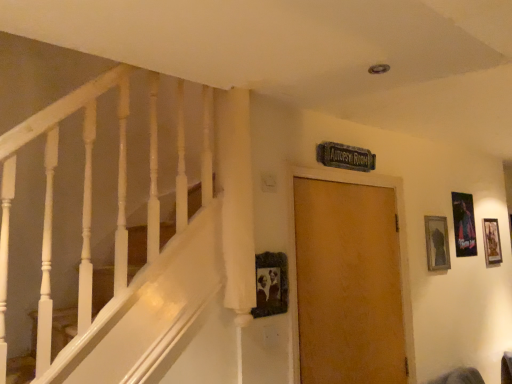
Question: Is wooden door at center wider or thinner than wooden photo frame at center, positioned as the fourth picture frame in back-to-front order?

Choices:
 (A) thin
 (B) wide

Answer: (B)

Question: From the image's perspective, is wooden door at center located above or below wooden photo frame at center, placed as the 1th picture frame when sorted from left to right?

Choices:
 (A) above
 (B) below

Answer: (B)

Question: Estimate the real-world distances between objects in this image. Which object is farther from the wooden photo frame at center, placed as the 1th picture frame when sorted from left to right?

Choices:
 (A) metallic silver poster at right, which ranks as the third picture frame in left-to-right order
 (B) metallic gold picture frame at right, which is the 1th picture frame in back-to-front order
 (C) wooden door at center
 (D) matte black picture frame at upper right, marked as the 3th picture frame in a right-to-left arrangement

Answer: (B)

Question: Based on their relative distances, which object is farther from the metallic gold picture frame at right, which is the 1th picture frame in back-to-front order?

Choices:
 (A) matte black picture frame at upper right, which is counted as the 2th picture frame, starting from the left
 (B) wooden photo frame at center, positioned as the fourth picture frame in back-to-front order
 (C) metallic silver poster at right, which is the 2th picture frame from right to left
 (D) wooden door at center

Answer: (B)